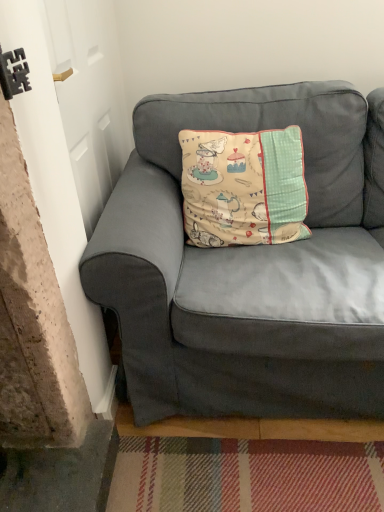
Identify the location of beige fabric cushion at center. (243, 187).

What do you see at coordinates (243, 187) in the screenshot? This screenshot has width=384, height=512. I see `beige fabric cushion at center` at bounding box center [243, 187].

Find the location of a particular element. matte gray couch at center is located at coordinates (249, 268).

What do you see at coordinates (249, 268) in the screenshot?
I see `matte gray couch at center` at bounding box center [249, 268].

Identify the location of beige fabric cushion at center. This screenshot has width=384, height=512. (243, 187).

Does beige fabric cushion at center appear on the left side of matte gray couch at center?

Yes.

Relative to matte gray couch at center, is beige fabric cushion at center in front or behind?

In the image, beige fabric cushion at center appears behind matte gray couch at center.

Which is closer to the camera, (299, 214) or (353, 146)?

Point (299, 214) is closer to the camera than point (353, 146).

From the image's perspective, who appears lower, beige fabric cushion at center or matte gray couch at center?

matte gray couch at center, from the image's perspective.

From a real-world perspective, is beige fabric cushion at center physically above matte gray couch at center?

Indeed, from a real-world perspective, beige fabric cushion at center stands above matte gray couch at center.

In terms of width, does beige fabric cushion at center look wider or thinner when compared to matte gray couch at center?

beige fabric cushion at center is thinner than matte gray couch at center.

From the picture: Considering the relative sizes of beige fabric cushion at center and matte gray couch at center in the image provided, is beige fabric cushion at center taller than matte gray couch at center?

No.

Does beige fabric cushion at center have a larger size compared to matte gray couch at center?

Incorrect, beige fabric cushion at center is not larger than matte gray couch at center.

Does beige fabric cushion at center contain matte gray couch at center?

No, matte gray couch at center is not a part of beige fabric cushion at center.

Is beige fabric cushion at center far away from matte gray couch at center?

No, beige fabric cushion at center is not far away from matte gray couch at center.

Is beige fabric cushion at center aimed at matte gray couch at center?

Yes, beige fabric cushion at center is facing matte gray couch at center.

How distant is beige fabric cushion at center from matte gray couch at center?

The distance of beige fabric cushion at center from matte gray couch at center is 7.89 inches.

Find the location of a particular element. This screenshot has height=512, width=384. pillow behind the matte gray couch at center is located at coordinates (243, 187).

Visually, is matte gray couch at center positioned to the left or to the right of beige fabric cushion at center?

Clearly, matte gray couch at center is on the right of beige fabric cushion at center in the image.

Does matte gray couch at center come in front of beige fabric cushion at center?

That is True.

Which is in front, point (161, 309) or point (304, 210)?

The point (161, 309) is closer to the camera.

Looking at this image, from the image's perspective, is matte gray couch at center located above or below beige fabric cushion at center?

Clearly, from the image's perspective, matte gray couch at center is below beige fabric cushion at center.

Consider the image. From a real-world perspective, is matte gray couch at center over beige fabric cushion at center?

No, from a real-world perspective, matte gray couch at center is not on top of beige fabric cushion at center.

Consider the image. Between matte gray couch at center and beige fabric cushion at center, which one has smaller width?

Thinner between the two is beige fabric cushion at center.

Between matte gray couch at center and beige fabric cushion at center, which one has more height?

matte gray couch at center.

Between matte gray couch at center and beige fabric cushion at center, which one has larger size?

matte gray couch at center.

Is beige fabric cushion at center completely or partially inside matte gray couch at center?

Yes.

Is matte gray couch at center far away from beige fabric cushion at center?

matte gray couch at center is near beige fabric cushion at center, not far away.

Consider the image. Is matte gray couch at center oriented towards beige fabric cushion at center?

Yes, matte gray couch at center is oriented towards beige fabric cushion at center.

From the picture: Measure the distance from matte gray couch at center to beige fabric cushion at center.

A distance of 7.89 inches exists between matte gray couch at center and beige fabric cushion at center.

Identify the location of pillow above the matte gray couch at center (from the image's perspective). (243, 187).

The width and height of the screenshot is (384, 512). I want to click on studio couch that is on the right side of beige fabric cushion at center, so click(x=249, y=268).

Image resolution: width=384 pixels, height=512 pixels. Find the location of `studio couch located in front of the beige fabric cushion at center`. studio couch located in front of the beige fabric cushion at center is located at coordinates (249, 268).